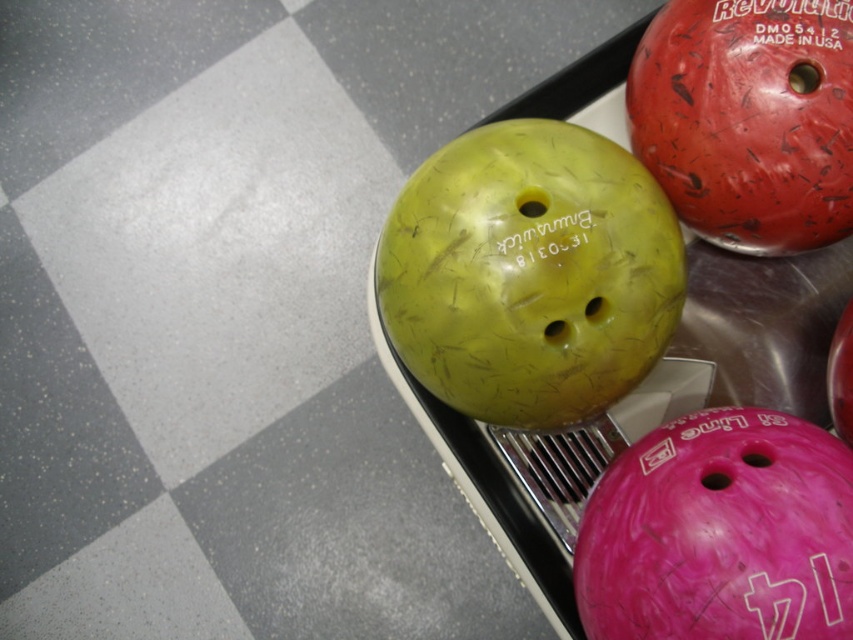
You are a bowler standing in front of the rack. You want to pick up the pink textured bowling ball at center and the red textured bowling ball at upper right. Which one is closer to your left side?

The pink textured bowling ball at center is to the left of the red textured bowling ball at upper right, so the pink textured bowling ball at center is closer to your left side.